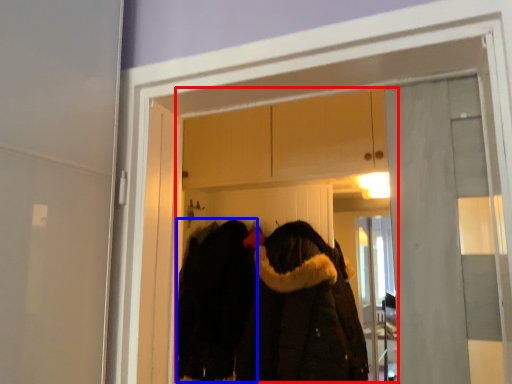
Question: Which point is closer to the camera, clothing store (highlighted by a red box) or cloak (highlighted by a blue box)?

Choices:
 (A) clothing store
 (B) cloak

Answer: (A)